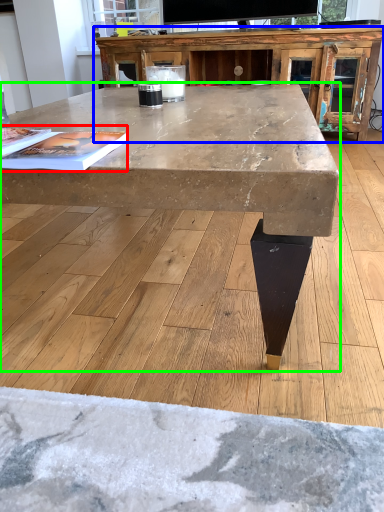
Question: Which object is the farthest from magazine (highlighted by a red box)? Choose among these: entertainment center (highlighted by a blue box) or coffee table (highlighted by a green box).

Choices:
 (A) entertainment center
 (B) coffee table

Answer: (A)